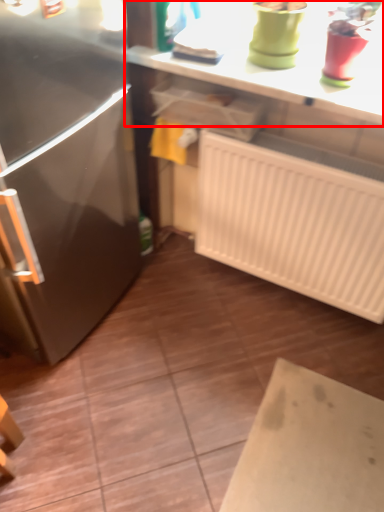
Question: From the image's perspective, where is countertop (annotated by the red box) located relative to radiator?

Choices:
 (A) above
 (B) below

Answer: (A)